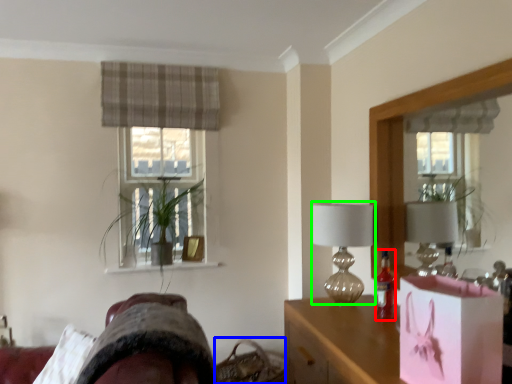
Question: Which object is the farthest from bottle (highlighted by a red box)? Choose among these: basket (highlighted by a blue box) or table lamp (highlighted by a green box).

Choices:
 (A) basket
 (B) table lamp

Answer: (A)